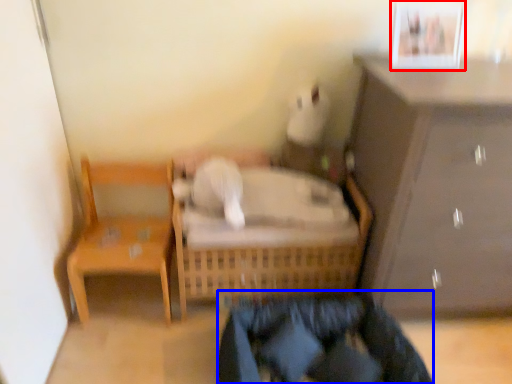
Question: Among these objects, which one is nearest to the camera, picture frame (highlighted by a red box) or clothing (highlighted by a blue box)?

Choices:
 (A) picture frame
 (B) clothing

Answer: (B)